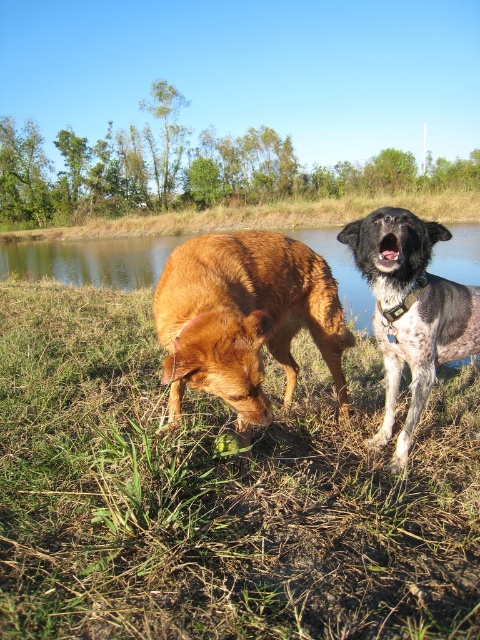
Does green grass at center have a greater height compared to speckled fur dog at right?

In fact, green grass at center may be shorter than speckled fur dog at right.

Is green grass at center below speckled fur dog at right?

Correct, green grass at center is located below speckled fur dog at right.

Locate an element on the screen. green grass at center is located at coordinates (218, 493).

Between golden brown fur at lower left and speckled fur dog at right, which one is positioned lower?

Positioned lower is golden brown fur at lower left.

What are the coordinates of `golden brown fur at lower left` in the screenshot? It's located at (244, 317).

Looking at this image, does green grass at center have a smaller size compared to golden brown fur at lower left?

Correct, green grass at center occupies less space than golden brown fur at lower left.

Which is behind, point (420, 557) or point (240, 294)?

The point (240, 294) is more distant.

Where is `green grass at center`? Image resolution: width=480 pixels, height=640 pixels. green grass at center is located at coordinates (218, 493).